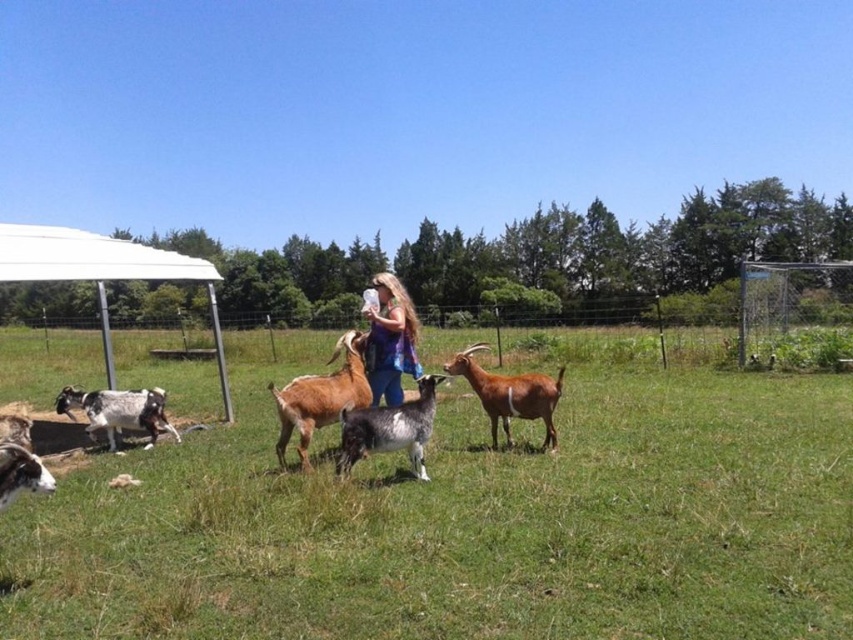
You are standing in the middle of the grassy field and see two points marked in the scene. Which point is closer to you? The points are labeled as point 1 at coordinates (399, 429) and point 2 at coordinates (146, 442). Please determine which one is closer based on their positions.

Point 1 at coordinates (399, 429) is in front of point 2 at coordinates (146, 442), so it is closer to you.